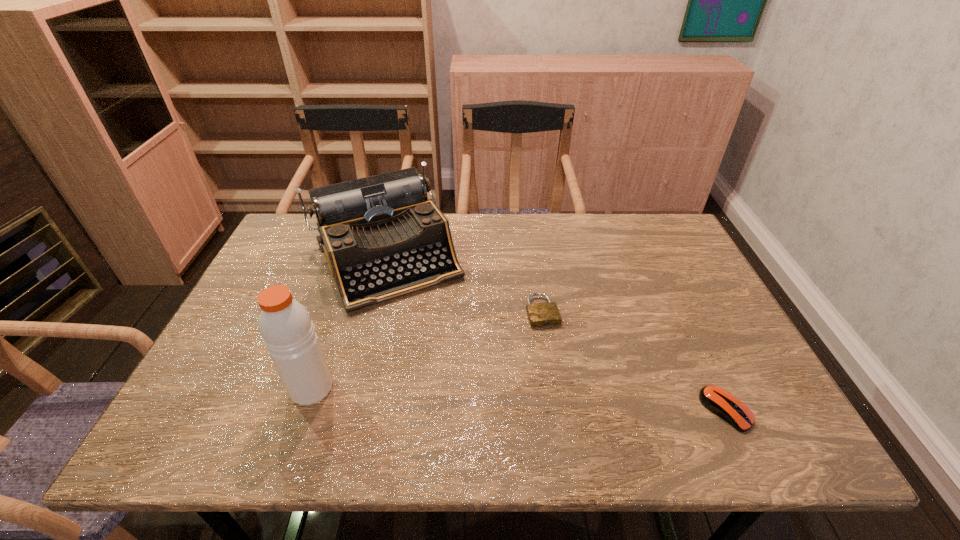
Where is `free spot that satisfies the following two spatial constraints: 1. on the back side of the tallest object; 2. on the left side of the third shortest object`? Image resolution: width=960 pixels, height=540 pixels. free spot that satisfies the following two spatial constraints: 1. on the back side of the tallest object; 2. on the left side of the third shortest object is located at coordinates tap(356, 258).